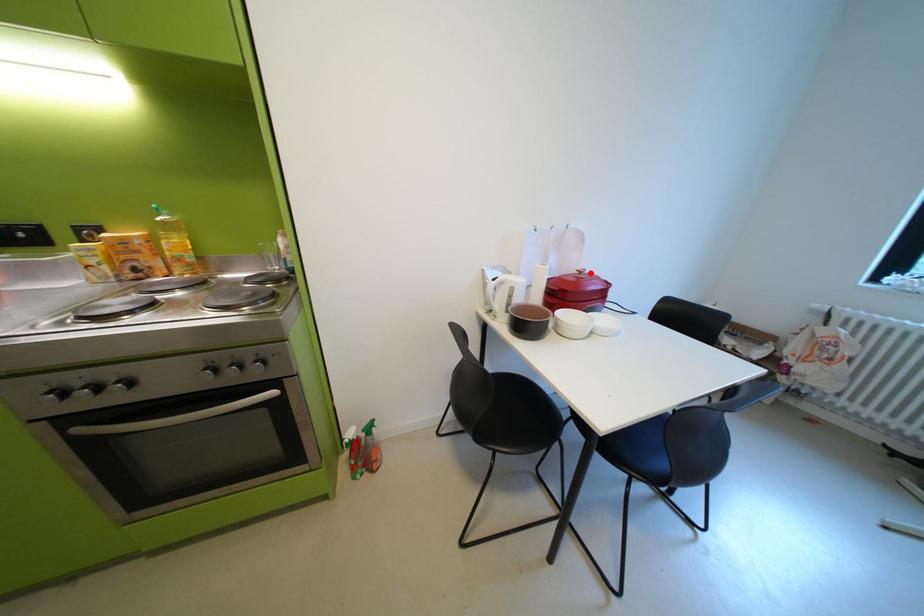
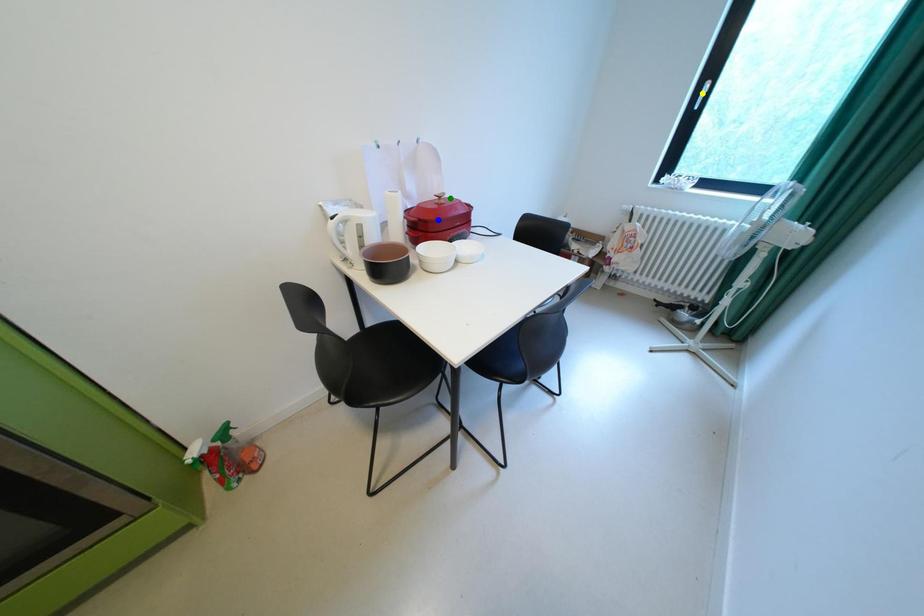
Question: I am providing you with two images of the same scene from different viewpoints. A red point is marked on the first image. You are given multiple points on the second image. In image 2, which mark is for the same physical point as the one in image 1?

Choices:
 (A) yellow point
 (B) green point
 (C) blue point

Answer: (B)